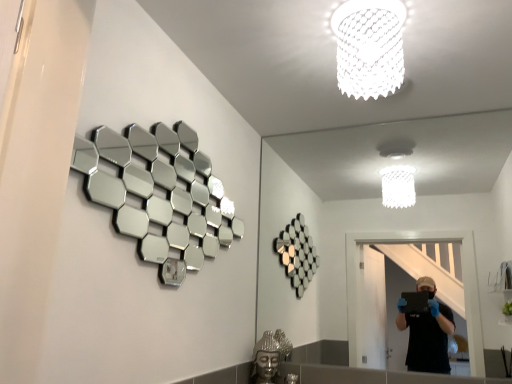
Question: Is point (288, 344) closer or farther from the camera than point (396, 77)?

Choices:
 (A) closer
 (B) farther

Answer: (B)

Question: From a real-world perspective, relative to white textured lampshade at upper center, is silver metallic buddha head at lower center vertically above or below?

Choices:
 (A) above
 (B) below

Answer: (B)

Question: Which object is positioned farthest from the silver reflective hexagonal mirrors at upper left, which is the second mirror from right to left?

Choices:
 (A) silver metallic buddha head at lower center
 (B) clear glass mirror at center, which is the second mirror in left-to-right order
 (C) white textured lampshade at upper center

Answer: (B)

Question: Based on their relative distances, which object is nearer to the silver reflective hexagonal mirrors at upper left, the first mirror when ordered from left to right?

Choices:
 (A) clear glass mirror at center, which ranks as the 1th mirror in right-to-left order
 (B) silver metallic buddha head at lower center
 (C) white textured lampshade at upper center

Answer: (B)